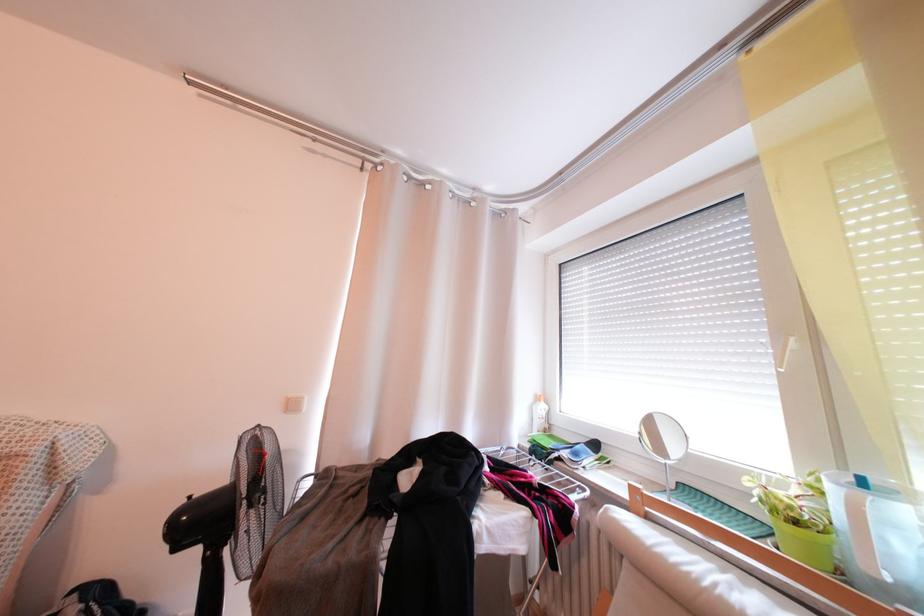
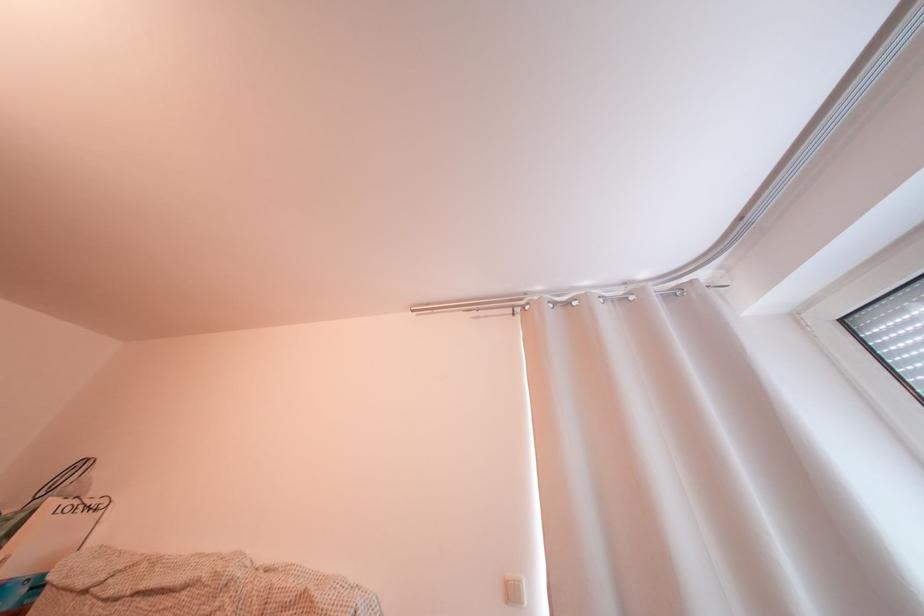
How did the camera likely rotate?

The camera rotated toward left-up.